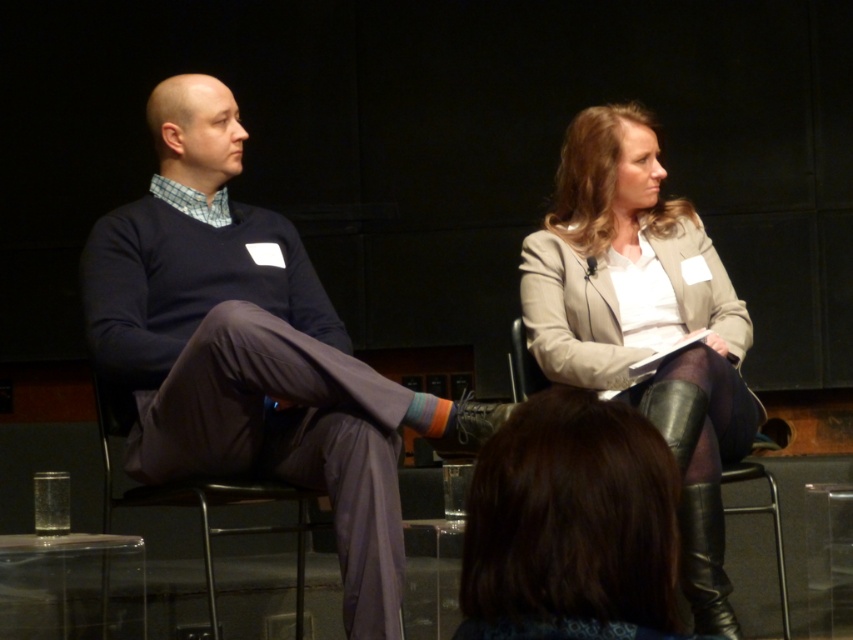
You are an event organizer who needs to arrange seating for the next panel. The current setup has the dark blue sweater at left and leather boots at lower right. If you want to place a name tag holder between them, where should you position it?

The name tag holder should be placed between the dark blue sweater at left and the leather boots at lower right. Since the dark blue sweater at left is above the leather boots at lower right, the holder should be positioned below the dark blue sweater at left and above the leather boots at lower right to place it in between them.

You are an event organizer and need to arrange a path for a wheelchair to move from the stage entrance to the podium. The wheelchair must avoid the area where the dark blue sweater at left and leather boots at lower right are located. Based on their positions, which direction should the wheelchair turn to avoid these objects?

The dark blue sweater at left is to the left of leather boots at lower right. To avoid both objects, the wheelchair should turn towards the center of the stage, away from the left and right extremes where the sweater and boots are positioned.